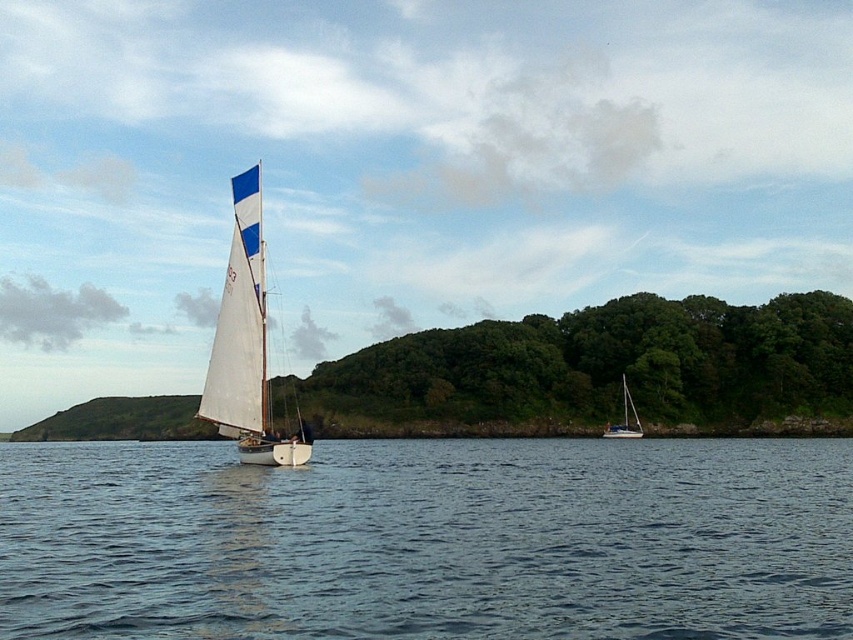
Question: Does blue water at center appear under white sail at left?

Choices:
 (A) yes
 (B) no

Answer: (A)

Question: Considering the real-world distances, which object is closest to the white sail at left?

Choices:
 (A) white glossy sailboat at center
 (B) blue water at center

Answer: (B)

Question: Which is nearer to the white sail at left?

Choices:
 (A) blue water at center
 (B) white glossy sailboat at center

Answer: (A)

Question: Is the position of white sail at left less distant than that of white glossy sailboat at center?

Choices:
 (A) no
 (B) yes

Answer: (B)

Question: Which point appears farthest from the camera in this image?

Choices:
 (A) (109, 628)
 (B) (628, 404)

Answer: (B)

Question: Does blue water at center come behind white sail at left?

Choices:
 (A) yes
 (B) no

Answer: (B)